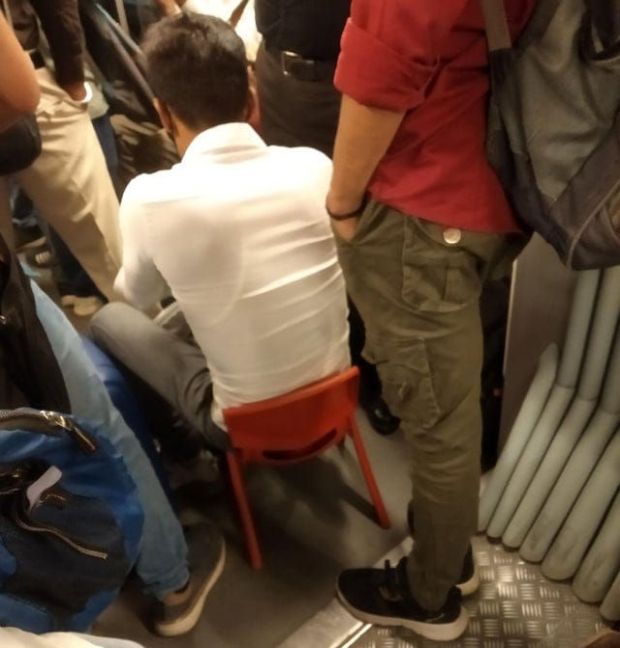
You are a GUI agent. You are given a task and a screenshot of the screen. Output one action in this format:
    pyautogui.click(x=<x>, y=<y>)
    Task: Click on the chair
    The width and height of the screenshot is (620, 648).
    Given the screenshot: What is the action you would take?
    pyautogui.click(x=247, y=507)